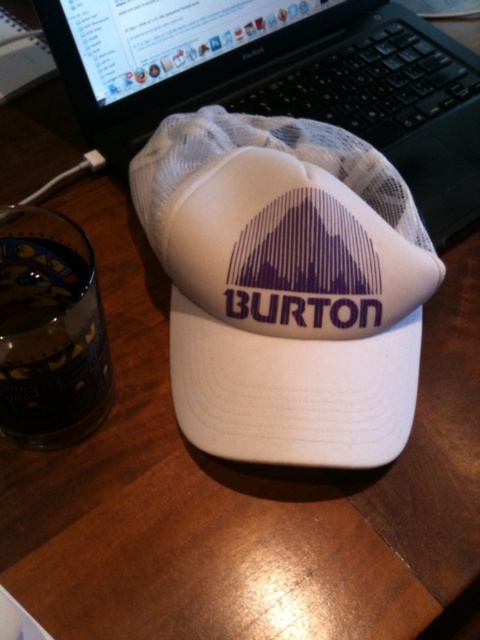
You are standing in front of a desk with a white baseball cap placed on it. The cap has a mountain design on the front. There is also a laptop visible in the background. What object is located at the coordinates point (286,285) on the desk?

The white mesh hat at center is located at point (286,285) on the desk.

You are organizing items on a desk and want to place a new item between the white mesh hat at center and the white mesh laptop at upper center. Is there enough space between them for a small notebook?

The white mesh hat at center is in front of the white mesh laptop at upper center, meaning they are aligned along the depth axis. Since the hat is closer to you and the laptop is further back, there is space between them along the depth to place the notebook.

Consider the image. You are looking at the image of the baseball cap and want to place a sticker exactly halfway between the two points labeled point (x=323, y=364) and point (x=432, y=54). Will the sticker be closer to the camera or further away compared to the original points?

The sticker placed halfway between point (x=323, y=364) and point (x=432, y=54) will be closer to the camera than point (x=432, y=54) but further away than point (x=323, y=364). However, since the question asks whether it is closer or further compared to the original points, the answer depends on which point we are comparing. Since point (x=323, y=364) is the closest to the camera, the sticker will be further away than that point but closer than the other. But the question might be interpreted as comparing to both,